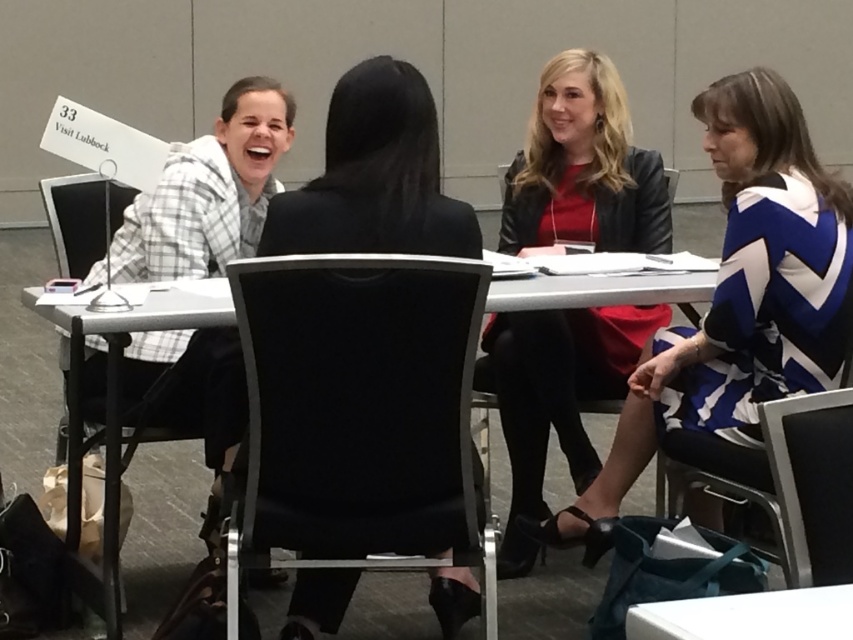
You are organizing a meeting for two people who need to sit comfortably. The black leather chair at lower right and the white plastic table at center are available. Which chair is more suitable for a person with wider hips?

The white plastic table at center is not a chair, so it cannot be used. The black leather chair at lower right is thinner, which might not provide enough support for someone with wider hips. Consider selecting a different chair that offers more width and support.